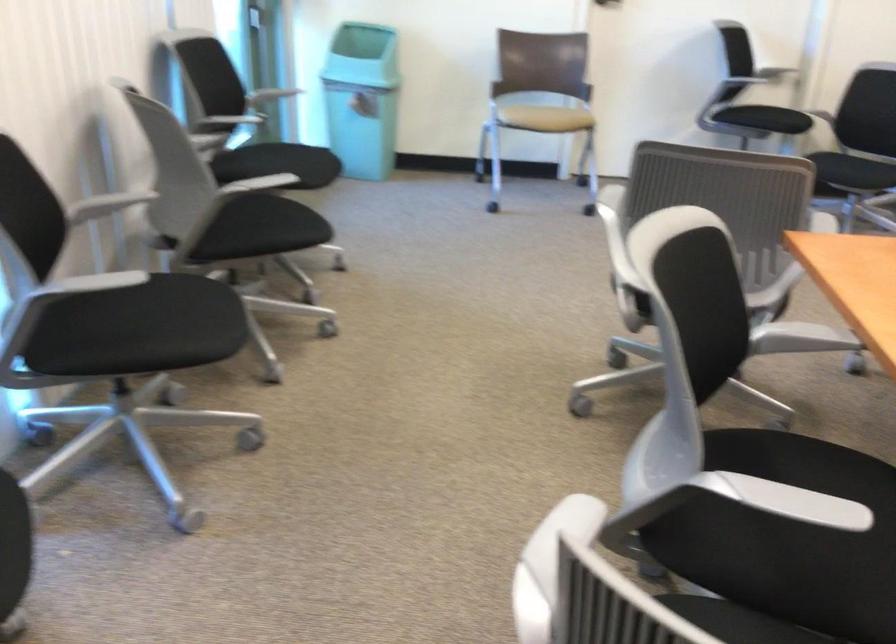
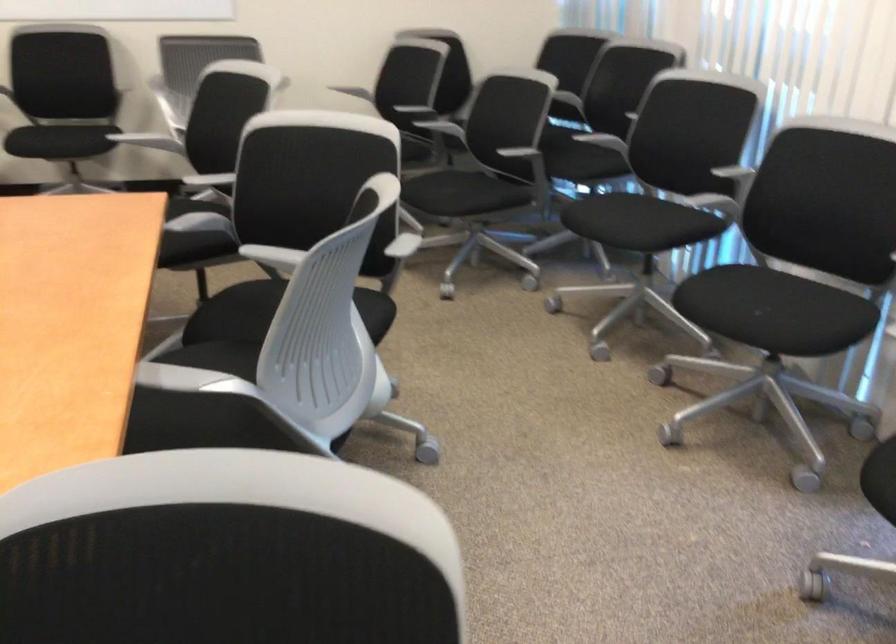
Find the pixel in the second image that matches (x=727, y=500) in the first image.

(273, 258)